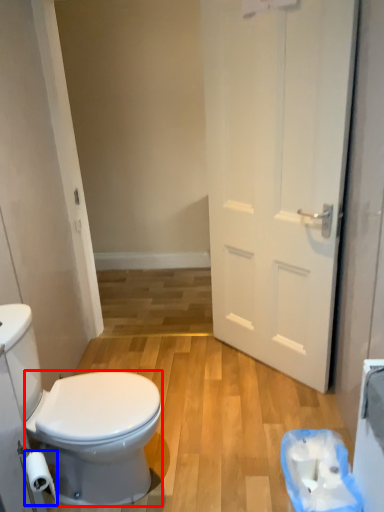
Question: Among these objects, which one is nearest to the camera, bidet (highlighted by a red box) or toilet paper (highlighted by a blue box)?

Choices:
 (A) bidet
 (B) toilet paper

Answer: (B)